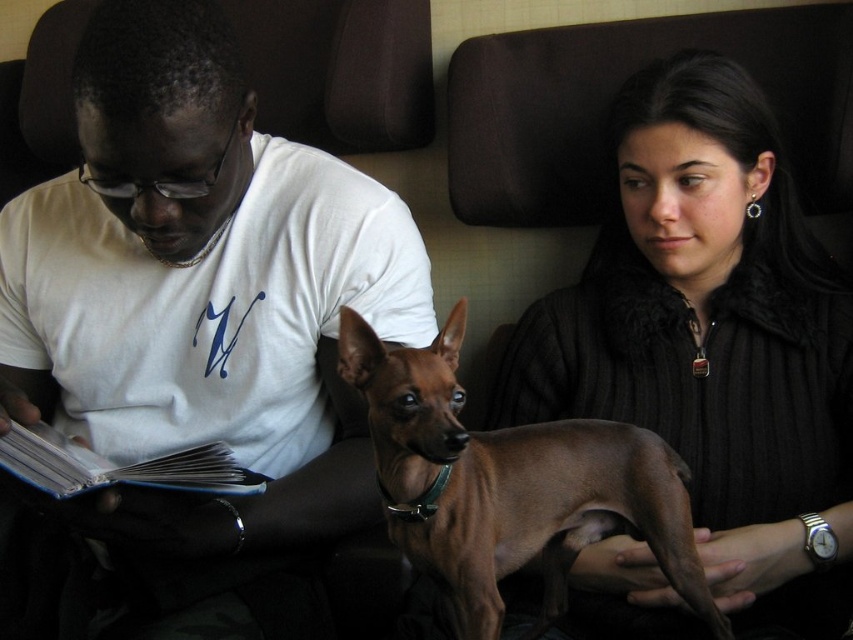
You are a photographer trying to capture a candid shot of the matte white shirt at center and the blue hardcover book at left. If you want to ensure both are in focus, which object should you focus on first, the larger one or the smaller one?

The matte white shirt at center is larger than the blue hardcover book at left. To ensure both are in focus, you should focus on the larger object first, as depth of field is maximized when focusing on objects at a middle distance between the camera and the subject. However, in this scenario, since the shirt and book are at similar distances, focusing on the larger object might help in achieving better overall sharpness.

You are a photographer trying to capture a portrait of the matte white shirt at center and the blue hardcover book at left. If you want to ensure both subjects are in focus, which one should you adjust the camera focus on first?

The matte white shirt at center is taller than the blue hardcover book at left, so you should focus on the matte white shirt at center first to ensure proper depth of field coverage for both subjects.